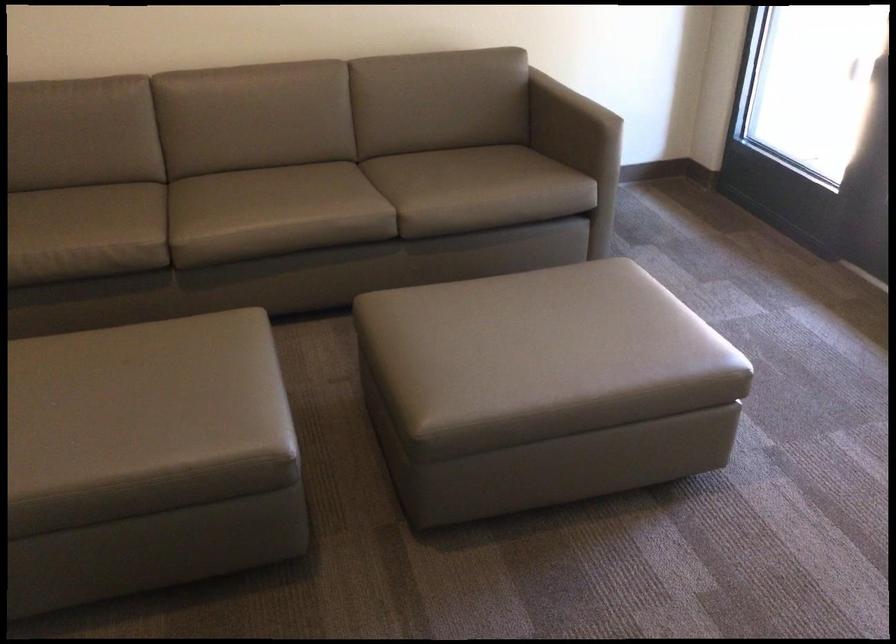
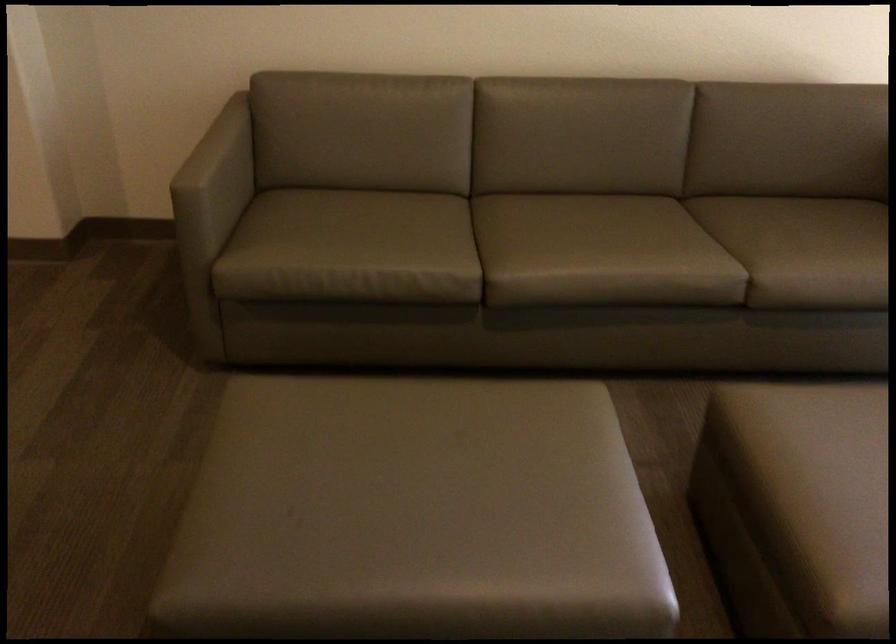
Locate, in the second image, the point that corresponds to (415,337) in the first image.

(814, 464)